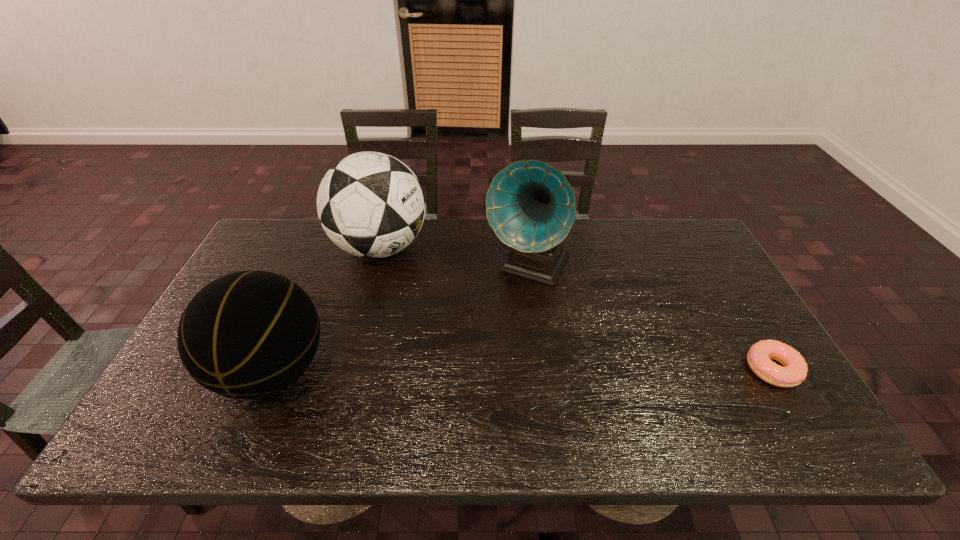
Identify the location of free spot on the desktop that is between the basketball and the rightmost object and is positioned from the horn of the phonograph_record. (470, 371).

Locate an element on the screen. This screenshot has width=960, height=540. vacant spot on the desktop that is between the basketball and the doughnut and is positioned on the surface of the soccer ball where the brand logo is visible is located at coordinates (470, 371).